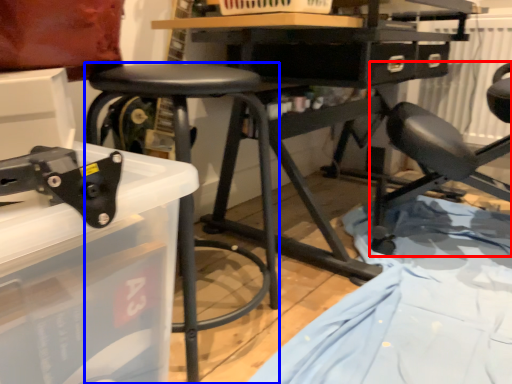
Question: Which object appears farthest to the camera in this image, chair (highlighted by a red box) or stool (highlighted by a blue box)?

Choices:
 (A) chair
 (B) stool

Answer: (A)